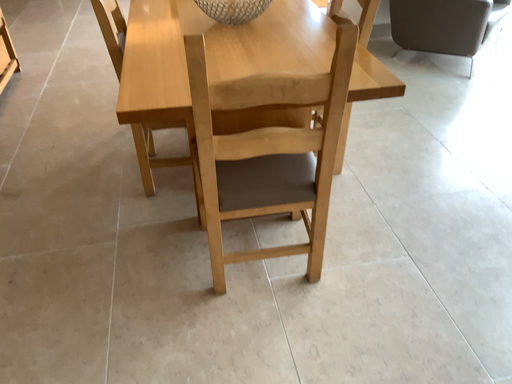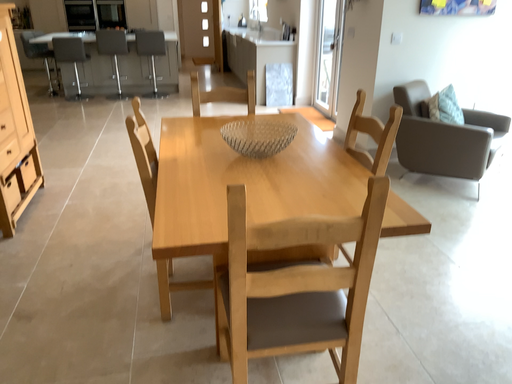
Question: Which way did the camera rotate in the video?

Choices:
 (A) rotated downward
 (B) rotated upward

Answer: (B)